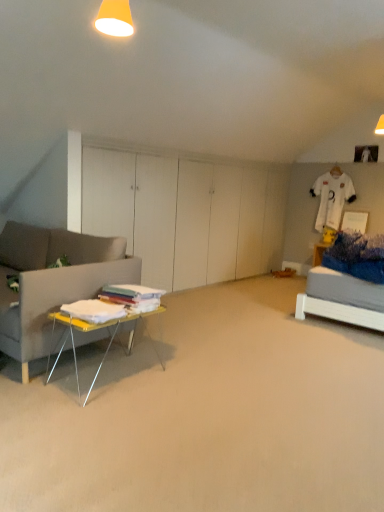
Identify the location of vacant area that is situated to the right of yellow metallic table at lower left. (195, 378).